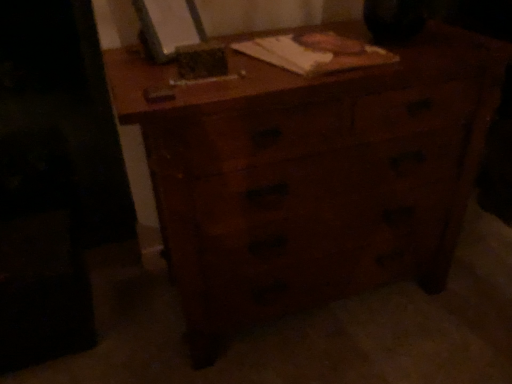
Where is `vacant space situated on the left part of wooden notebook at center`? The height and width of the screenshot is (384, 512). vacant space situated on the left part of wooden notebook at center is located at coordinates (193, 72).